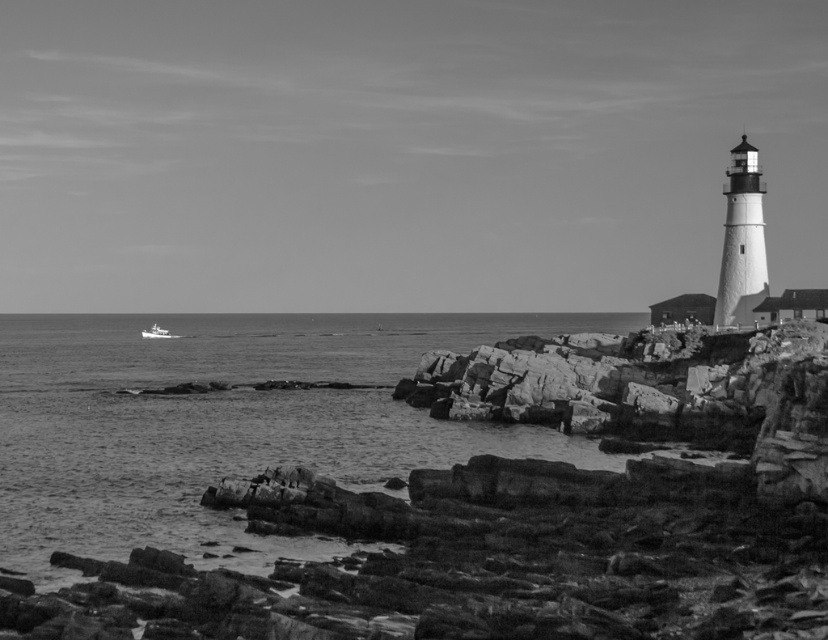
Is smooth water at lower left below white plastic boat at left?

Indeed, smooth water at lower left is positioned under white plastic boat at left.

Is point (373, 456) farther from viewer compared to point (171, 333)?

No.

Where is `smooth water at lower left`? smooth water at lower left is located at coordinates (225, 422).